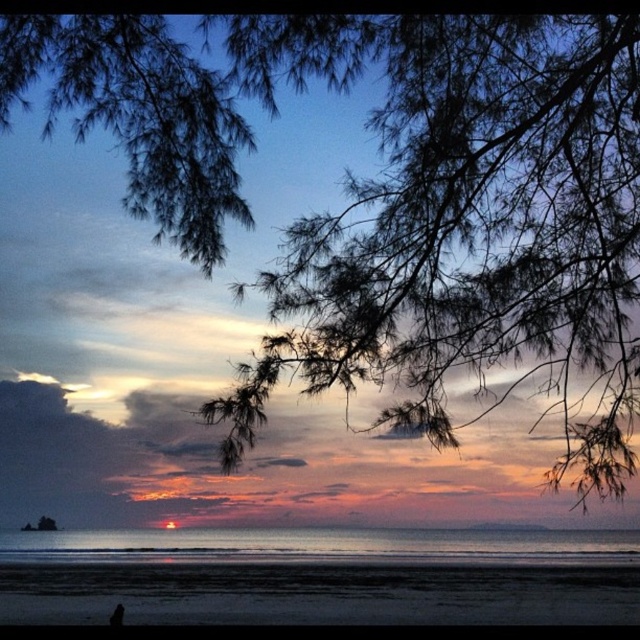
Question: Which object appears farthest from the camera in this image?

Choices:
 (A) black matte person at lower left
 (B) sandy beach at lower center

Answer: (B)

Question: Is sandy beach at lower center above black matte person at lower left?

Choices:
 (A) no
 (B) yes

Answer: (A)

Question: Can you confirm if sandy beach at lower center is wider than black matte person at lower left?

Choices:
 (A) no
 (B) yes

Answer: (B)

Question: Which point is farther to the camera?

Choices:
 (A) (550, 584)
 (B) (113, 609)

Answer: (A)

Question: Is sandy beach at lower center below black matte person at lower left?

Choices:
 (A) no
 (B) yes

Answer: (B)